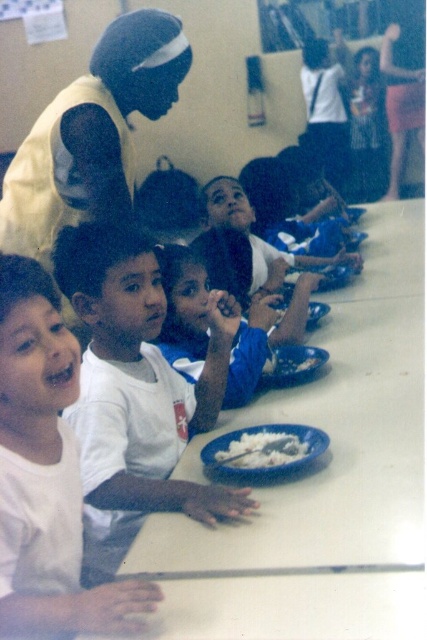
This screenshot has width=427, height=640. What do you see at coordinates (260, 449) in the screenshot? I see `white creamy food at center` at bounding box center [260, 449].

Does point (306, 451) lie behind point (269, 376)?

No, it is not.

This screenshot has height=640, width=427. I want to click on white creamy food at center, so click(260, 449).

Locate an element on the screen. This screenshot has width=427, height=640. white creamy food at center is located at coordinates (260, 449).

Who is shorter, white matte shirt at center or white creamy food at center?

white creamy food at center

Is white matte shirt at center to the left of white creamy food at center from the viewer's perspective?

Correct, you'll find white matte shirt at center to the left of white creamy food at center.

Who is more forward, (111, 560) or (268, 458)?

Point (268, 458)

Locate an element on the screen. The height and width of the screenshot is (640, 427). white matte shirt at center is located at coordinates (137, 388).

Measure the distance between white matte shirt at center and white matte shirt at left.

white matte shirt at center and white matte shirt at left are 29.34 centimeters apart.

Is white matte shirt at center to the right of white matte shirt at left from the viewer's perspective?

Indeed, white matte shirt at center is positioned on the right side of white matte shirt at left.

Which is in front, point (93, 442) or point (60, 528)?

Point (60, 528) is more forward.

Locate an element on the screen. white matte shirt at center is located at coordinates (137, 388).